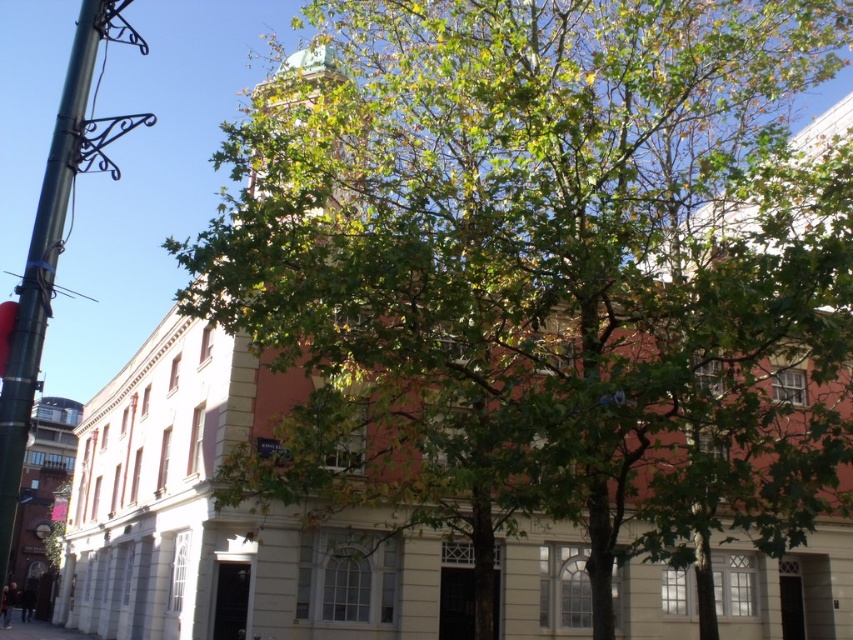
Question: Is green metallic pole at left to the right of concrete pavement at lower left from the viewer's perspective?

Choices:
 (A) yes
 (B) no

Answer: (A)

Question: In this image, where is green metallic pole at left located relative to concrete pavement at lower left?

Choices:
 (A) left
 (B) right

Answer: (B)

Question: Which of these objects is positioned closest to the concrete pavement at lower left?

Choices:
 (A) green copper dome at center
 (B) green metallic pole at left

Answer: (A)

Question: Does green metallic pole at left appear on the left side of green copper dome at center?

Choices:
 (A) yes
 (B) no

Answer: (A)

Question: Which of the following is the closest to the observer?

Choices:
 (A) green copper dome at center
 (B) concrete pavement at lower left
 (C) green metallic pole at left

Answer: (C)

Question: Which of the following is the farthest from the observer?

Choices:
 (A) green copper dome at center
 (B) concrete pavement at lower left
 (C) green metallic pole at left

Answer: (B)